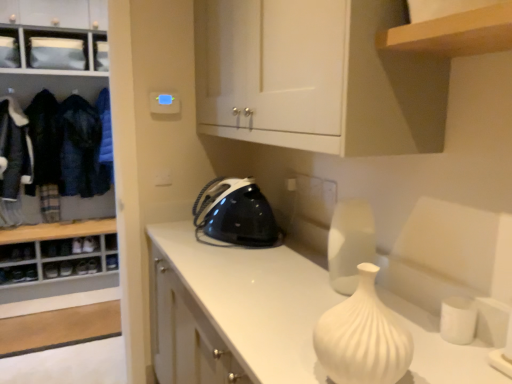
Question: Considering the relative positions of dark blue woolen jacket at left, which ranks as the 2th clothing in left-to-right order, and white matte vase at center in the image provided, is dark blue woolen jacket at left, which ranks as the 2th clothing in left-to-right order, to the left or to the right of white matte vase at center?

Choices:
 (A) left
 (B) right

Answer: (A)

Question: From their relative heights in the image, would you say dark blue woolen jacket at left, the third clothing when ordered from right to left, is taller or shorter than white matte vase at center?

Choices:
 (A) tall
 (B) short

Answer: (A)

Question: Estimate the real-world distances between objects in this image. Which object is farther from the white matte vase at center?

Choices:
 (A) white matte vase at center
 (B) denim jacket at left, which is the second clothing from right to left
 (C) dark blue woolen jacket at left, which ranks as the 2th clothing in left-to-right order
 (D) white matte cabinet at upper center, the first cabinetry from the front
 (E) blue fabric at left, which ranks as the 1th clothing in right-to-left order

Answer: (C)

Question: Which of these objects is positioned closest to the white matte cabinet at upper center, arranged as the 1th cabinetry when viewed from the right?

Choices:
 (A) white matte vase at center
 (B) white wood cabinet at left, the first cabinetry viewed from the left
 (C) blue fabric at left, the fourth clothing from the left
 (D) white glossy countertop at center
 (E) denim jacket at left, arranged as the 3th clothing when viewed from the left

Answer: (A)